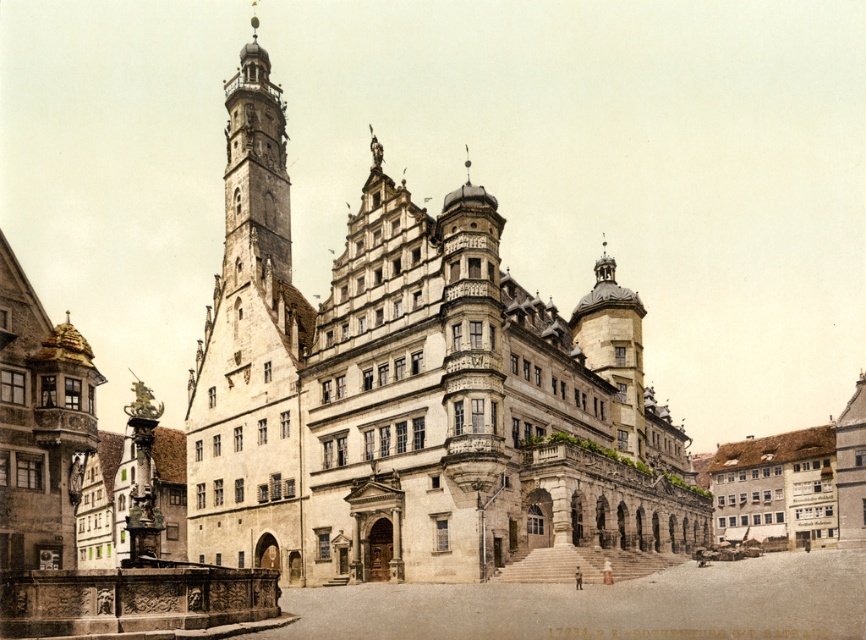
Question: Among these points, which one is nearest to the camera?

Choices:
 (A) (695, 508)
 (B) (251, 420)

Answer: (B)

Question: Does stone building at center appear on the right side of stone tower at left?

Choices:
 (A) yes
 (B) no

Answer: (A)

Question: Which point appears farthest from the camera in this image?

Choices:
 (A) (281, 202)
 (B) (482, 547)

Answer: (A)

Question: Is stone building at center below stone tower at left?

Choices:
 (A) no
 (B) yes

Answer: (B)

Question: Does stone building at center appear on the right side of stone tower at left?

Choices:
 (A) no
 (B) yes

Answer: (B)